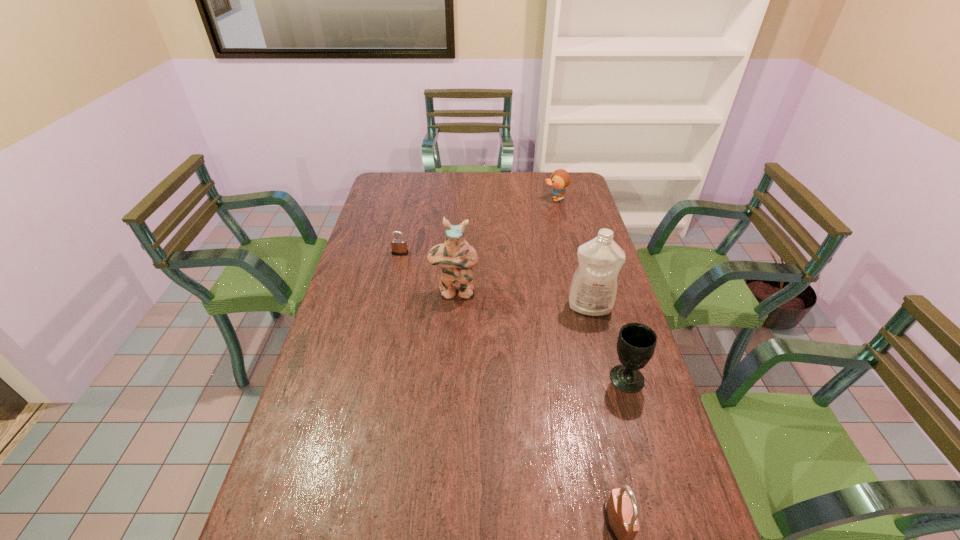
This screenshot has height=540, width=960. I want to click on vacant space situated 0.220m on the back of the chalice, so click(x=606, y=309).

Find the location of a particular element. The width and height of the screenshot is (960, 540). free space located on the back of the detergent is located at coordinates (579, 266).

Locate an element on the screen. Image resolution: width=960 pixels, height=540 pixels. vacant space positioned 0.190m on the front-facing side of the second object from left to right is located at coordinates (451, 347).

The width and height of the screenshot is (960, 540). I want to click on object present at the far edge, so [560, 179].

Find the location of a particular element. This screenshot has height=540, width=960. object located in the left edge section of the desktop is located at coordinates (399, 246).

Identify the location of duck located at the right edge. (560, 179).

You are a GUI agent. You are given a task and a screenshot of the screen. Output one action in this format:
    pyautogui.click(x=<x>, y=<y>)
    Task: Click on the chalice present at the right edge
    Image resolution: width=960 pixels, height=540 pixels.
    Given the screenshot: What is the action you would take?
    pyautogui.click(x=636, y=343)

Locate an element on the screen. This screenshot has width=960, height=540. detergent that is positioned at the right edge is located at coordinates (593, 289).

Find the location of a particular element. object positioned at the far right corner is located at coordinates (560, 179).

In the image, there is a desktop. In order to click on vacant space at the far edge in this screenshot , I will do `click(456, 191)`.